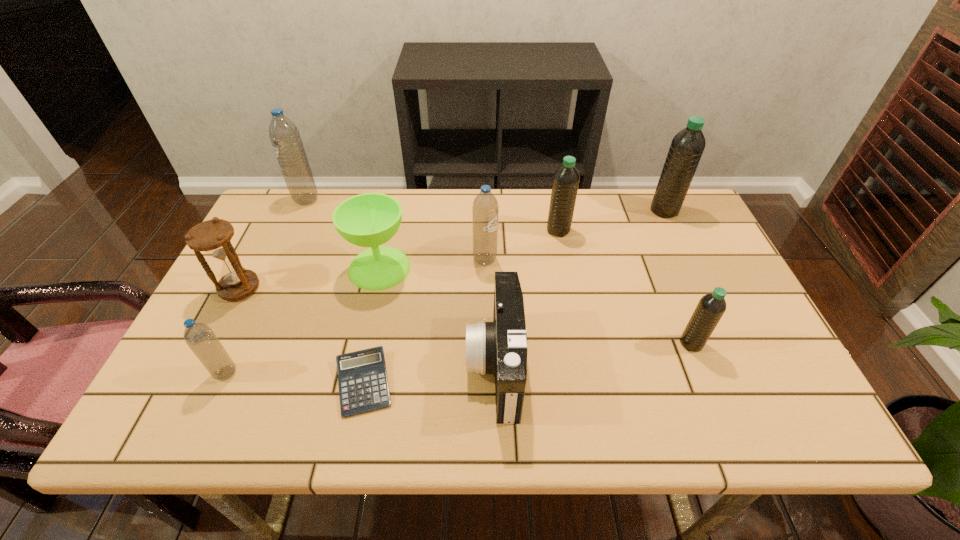
Image resolution: width=960 pixels, height=540 pixels. Identify the location of the rightmost object. (687, 146).

The width and height of the screenshot is (960, 540). Identify the location of the rightmost water bottle. (687, 146).

I want to click on the farthest blue water bottle, so click(285, 138).

Where is `the third object from right to left`? The image size is (960, 540). the third object from right to left is located at coordinates (566, 179).

At what (x,y) coordinates should I click in order to perform the action: click on the fourth water bottle from left to right. Please return your answer as a coordinate pair (x, y). Looking at the image, I should click on (566, 179).

The height and width of the screenshot is (540, 960). Find the location of `the second biggest blue water bottle`. the second biggest blue water bottle is located at coordinates (485, 207).

This screenshot has width=960, height=540. Find the location of `the second nearest blue water bottle`. the second nearest blue water bottle is located at coordinates (485, 207).

You are a GUI agent. You are given a task and a screenshot of the screen. Output one action in this format:
    pyautogui.click(x=<x>, y=<y>)
    Task: Click on the hourglass
    
    Given the screenshot: What is the action you would take?
    pyautogui.click(x=213, y=237)

At what (x,y) coordinates should I click in order to perform the action: click on wineglass. Please return your answer as a coordinate pair (x, y). Looking at the image, I should click on (371, 219).

Where is `the smallest black water bottle`? the smallest black water bottle is located at coordinates (711, 307).